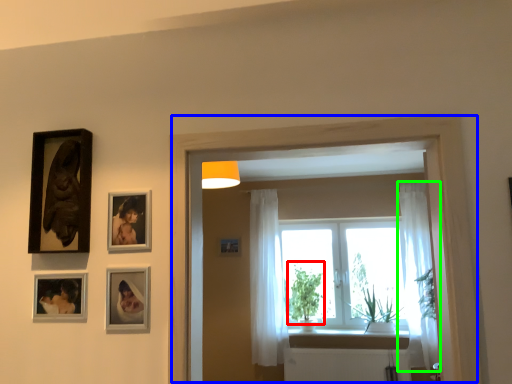
Question: Which object is the farthest from plant (highlighted by a red box)? Choose among these: window frame (highlighted by a blue box) or curtain (highlighted by a green box).

Choices:
 (A) window frame
 (B) curtain

Answer: (A)